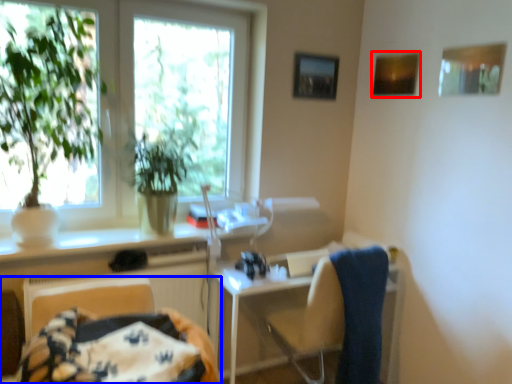
Question: Which object appears closest to the camera in this image, picture frame (highlighted by a red box) or furniture (highlighted by a blue box)?

Choices:
 (A) picture frame
 (B) furniture

Answer: (B)